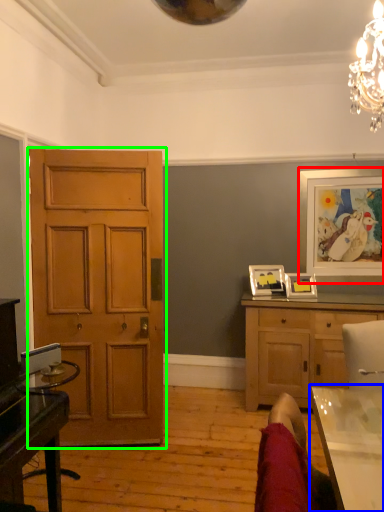
Question: Based on their relative distances, which object is farther from picture frame (highlighted by a red box)? Choose from table (highlighted by a blue box) and door (highlighted by a green box).

Choices:
 (A) table
 (B) door

Answer: (A)